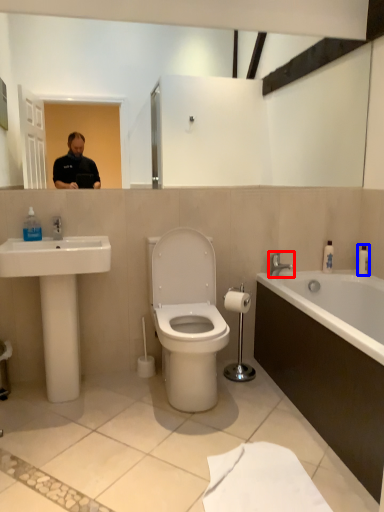
Question: Among these objects, which one is nearest to the camera, tap (highlighted by a red box) or toiletry (highlighted by a blue box)?

Choices:
 (A) tap
 (B) toiletry

Answer: (A)